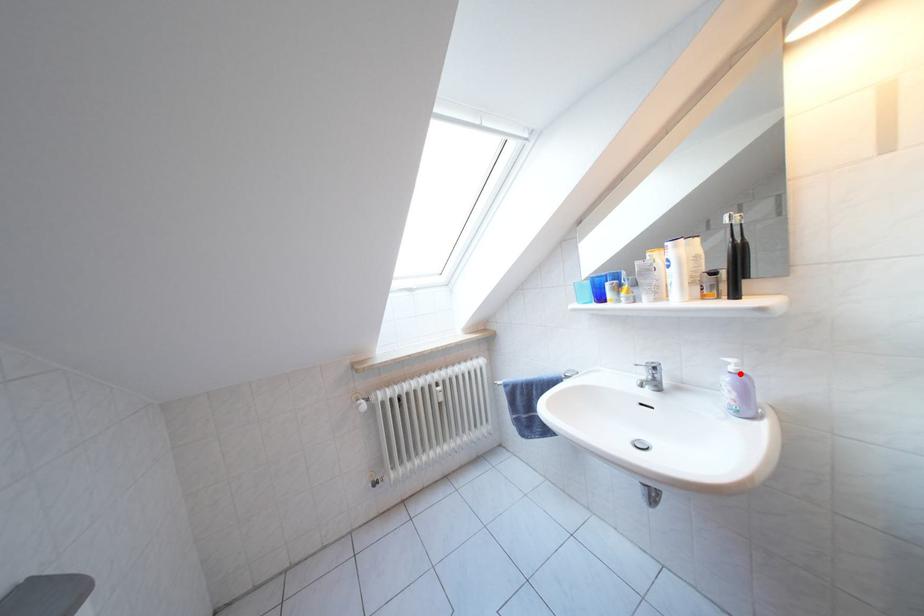
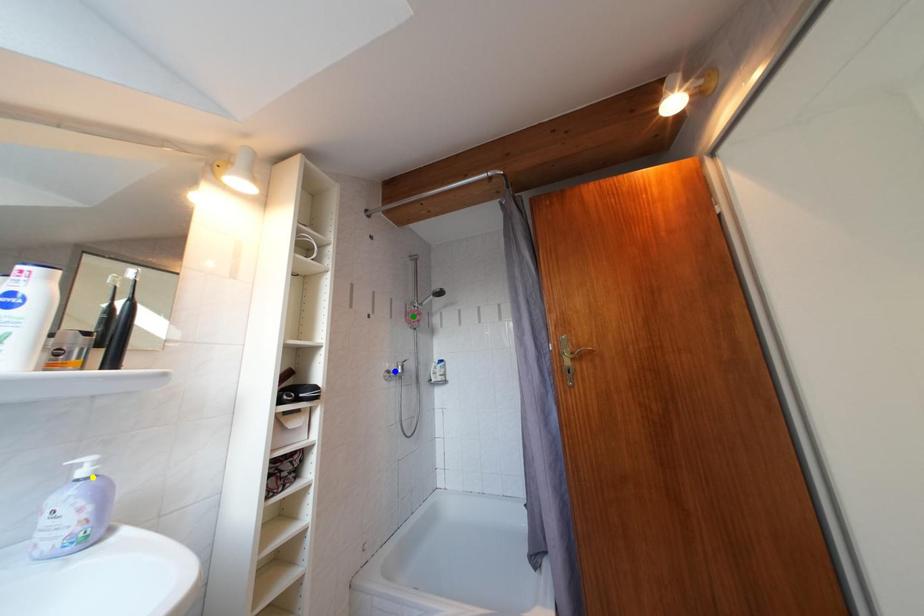
Question: I am providing you with two images of the same scene from different viewpoints. A red point is marked on the first image. You are given multiple points on the second image. Which spot in image 2 lines up with the point in image 1?

Choices:
 (A) yellow point
 (B) blue point
 (C) green point

Answer: (A)